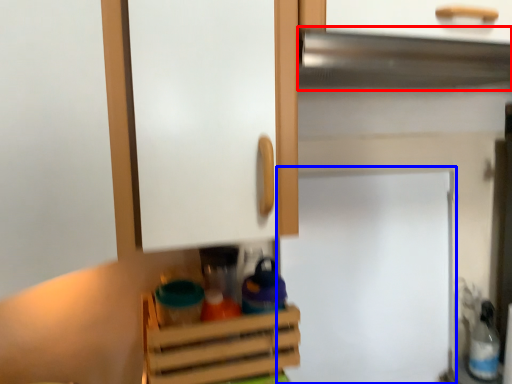
Question: Among these objects, which one is farthest to the camera, exhaust hood (highlighted by a red box) or fridge (highlighted by a blue box)?

Choices:
 (A) exhaust hood
 (B) fridge

Answer: (B)